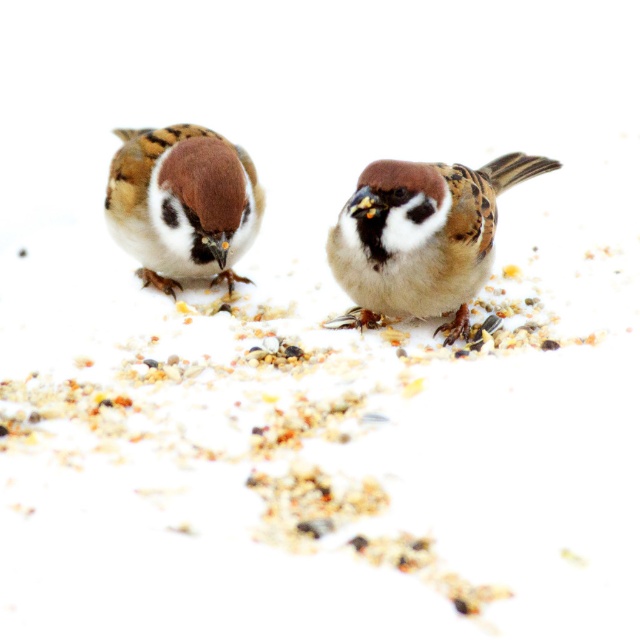
You are a birdwatcher observing two brown matte sparrows in the image. Which one has a larger width between the brown matte sparrow at center and the brown matte sparrow at left?

The brown matte sparrow at center might be wider than brown matte sparrow at left according to the description.

You are a birdwatcher observing two brown matte sparrows in the image. Which sparrow is positioned lower on the image, the brown matte sparrow at center or the brown matte sparrow at left?

The brown matte sparrow at center is located below the brown matte sparrow at left, so the brown matte sparrow at center is positioned lower.